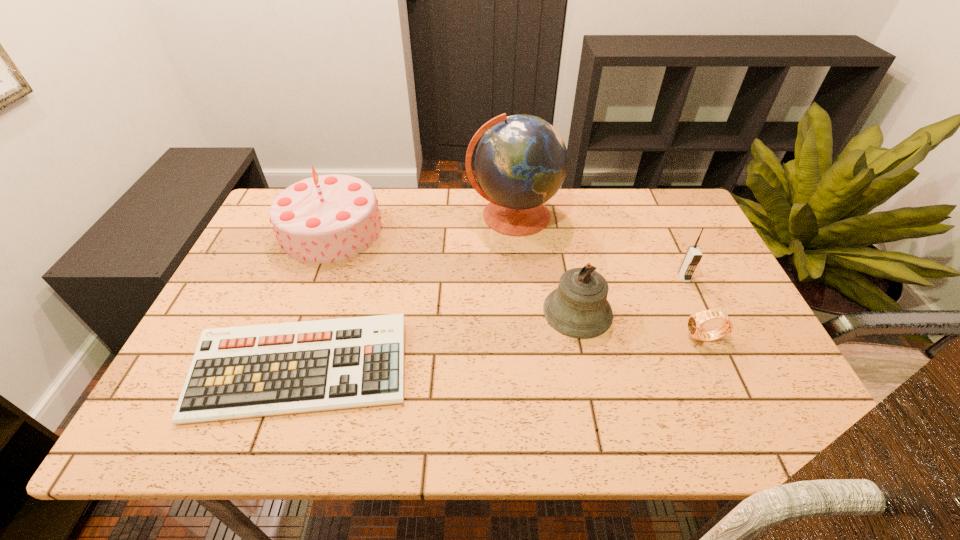
I want to click on free space located 0.320m on the face of the second shortest object, so click(551, 338).

Identify the location of free region located 0.360m on the face of the second shortest object. (535, 338).

Locate an element on the screen. Image resolution: width=960 pixels, height=540 pixels. vacant area situated 0.290m on the face of the second shortest object is located at coordinates (564, 338).

This screenshot has height=540, width=960. Find the location of `vacant position located 0.140m on the back of the shortest object`. vacant position located 0.140m on the back of the shortest object is located at coordinates (330, 282).

You are a GUI agent. You are given a task and a screenshot of the screen. Output one action in this format:
    pyautogui.click(x=<x>, y=<y>)
    Task: Click on the globe at the far edge
    
    Given the screenshot: What is the action you would take?
    pyautogui.click(x=521, y=161)

What are the coordinates of `birthday cake located in the far edge section of the desktop` in the screenshot? It's located at (328, 218).

Find the location of a particular element. object located in the near edge section of the desktop is located at coordinates (248, 371).

The height and width of the screenshot is (540, 960). What are the coordinates of `birthday cake at the left edge` in the screenshot? It's located at (328, 218).

At what (x,y) coordinates should I click in order to perform the action: click on computer keyboard at the left edge. Please return your answer as a coordinate pair (x, y). The height and width of the screenshot is (540, 960). Looking at the image, I should click on click(x=248, y=371).

You are a GUI agent. You are given a task and a screenshot of the screen. Output one action in this format:
    pyautogui.click(x=<x>, y=<y>)
    Task: Click on the cellular telephone positioned at the right edge
    The height and width of the screenshot is (540, 960).
    Given the screenshot: What is the action you would take?
    pyautogui.click(x=693, y=256)